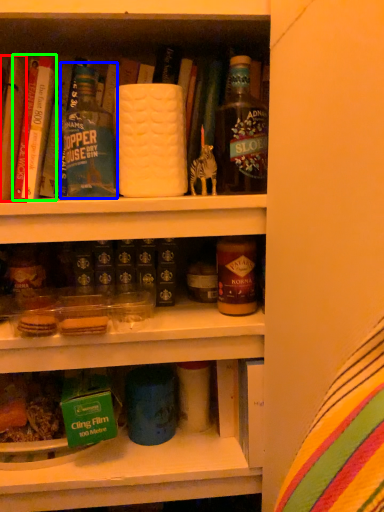
Question: Which object is positioned farthest from book (highlighted by a red box)? Select from bottle (highlighted by a blue box) and book (highlighted by a green box).

Choices:
 (A) bottle
 (B) book

Answer: (A)